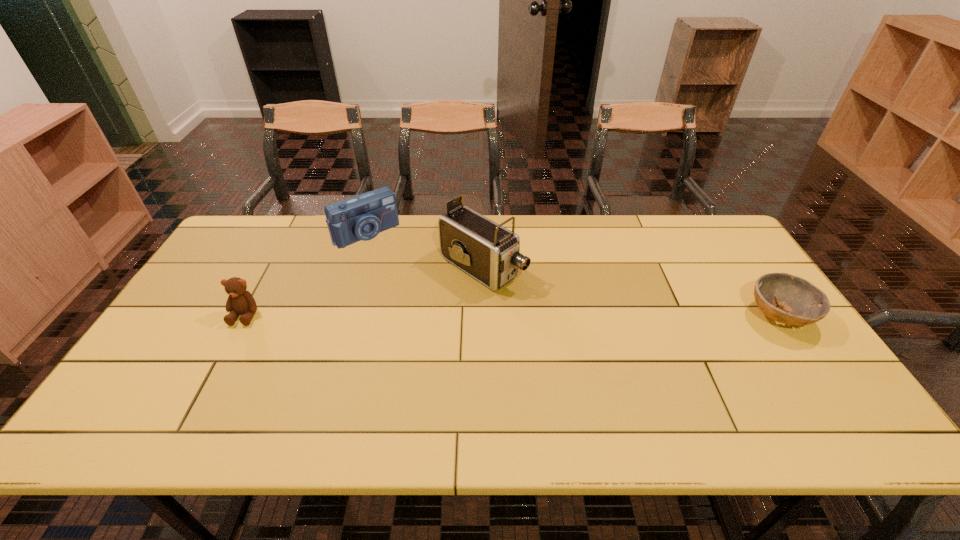
The height and width of the screenshot is (540, 960). I want to click on vacant region located at the lens of the second object from right to left, so click(618, 351).

Locate an element on the screen. This screenshot has height=540, width=960. free spot located 0.390m at the lens of the second object from right to left is located at coordinates (633, 360).

Identify the location of free location located 0.050m on the lens of the third object from right to left. This screenshot has width=960, height=540. (388, 254).

Where is `vacant space located on the lens of the third object from right to left`? vacant space located on the lens of the third object from right to left is located at coordinates (438, 312).

This screenshot has width=960, height=540. I want to click on vacant space situated on the lens of the third object from right to left, so click(x=391, y=258).

Locate an element on the screen. This screenshot has width=960, height=540. camcorder located in the far edge section of the desktop is located at coordinates (490, 253).

Identify the location of camera present at the far edge. (362, 217).

Where is `object situated at the left edge`? object situated at the left edge is located at coordinates (240, 301).

The image size is (960, 540). Identify the location of object situated at the right edge. (802, 303).

Where is `vacant space at the far edge`? Image resolution: width=960 pixels, height=540 pixels. vacant space at the far edge is located at coordinates (315, 219).